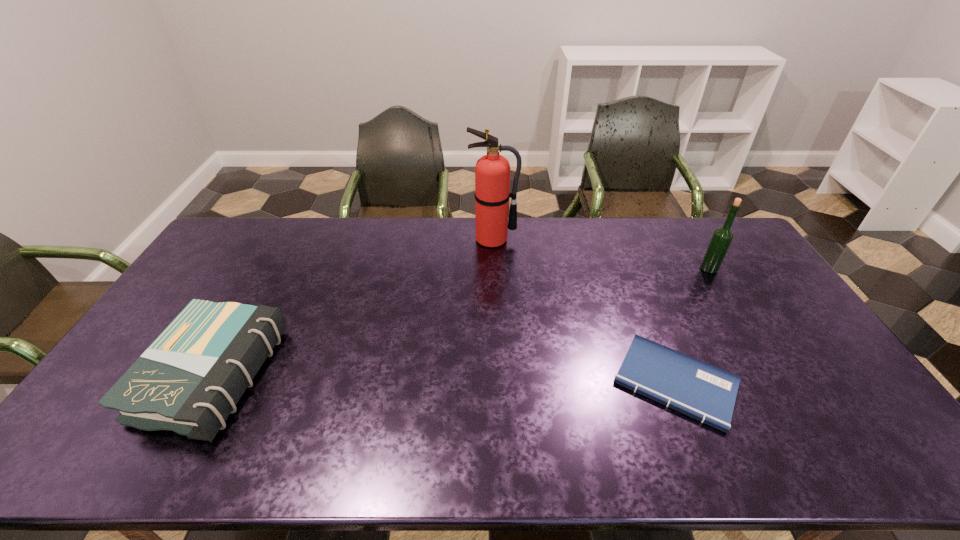
Where is `vacant space situated on the back of the left paperback book`? vacant space situated on the back of the left paperback book is located at coordinates (282, 248).

Where is `vacant area located 0.300m on the back of the shorter paperback book`? Image resolution: width=960 pixels, height=540 pixels. vacant area located 0.300m on the back of the shorter paperback book is located at coordinates (632, 273).

You are a GUI agent. You are given a task and a screenshot of the screen. Output one action in this format:
    pyautogui.click(x=<x>, y=<y>)
    Task: Click on the object at the far edge
    This screenshot has height=540, width=960.
    Given the screenshot: What is the action you would take?
    pyautogui.click(x=492, y=171)

In order to click on object that is at the left edge in this screenshot , I will do `click(189, 380)`.

Identify the location of object situated at the right edge. (722, 237).

Where is `object located at the near left corner`? object located at the near left corner is located at coordinates (189, 380).

The height and width of the screenshot is (540, 960). In order to click on free space at the far edge of the desktop in this screenshot , I will do `click(278, 220)`.

Image resolution: width=960 pixels, height=540 pixels. In order to click on free space at the near edge of the desktop in this screenshot , I will do `click(274, 440)`.

At what (x,y) coordinates should I click in order to perform the action: click on vacant region at the left edge of the desktop. Please return your answer as a coordinate pair (x, y). This screenshot has height=540, width=960. Looking at the image, I should click on (102, 417).

Where is `free spot at the right edge of the desktop`? This screenshot has height=540, width=960. free spot at the right edge of the desktop is located at coordinates (793, 376).